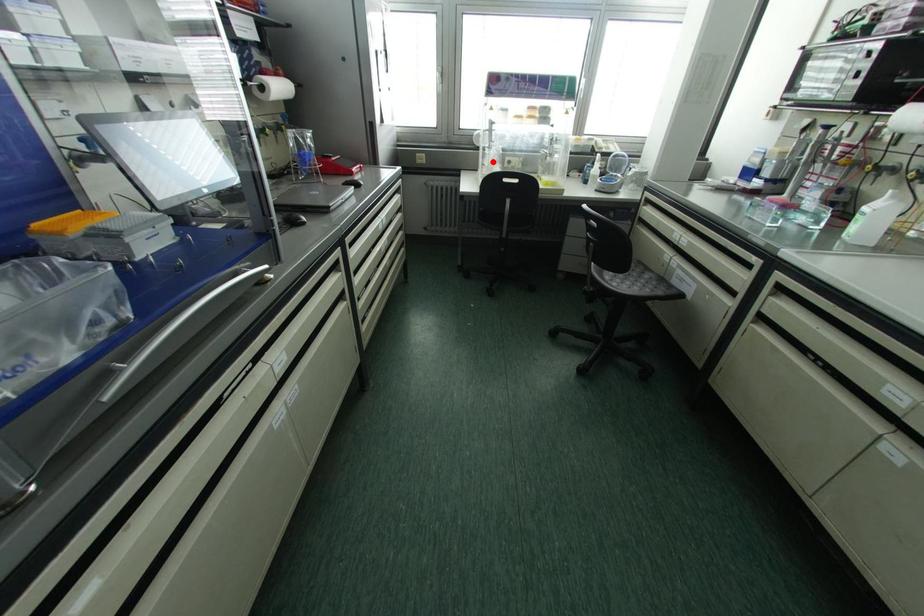
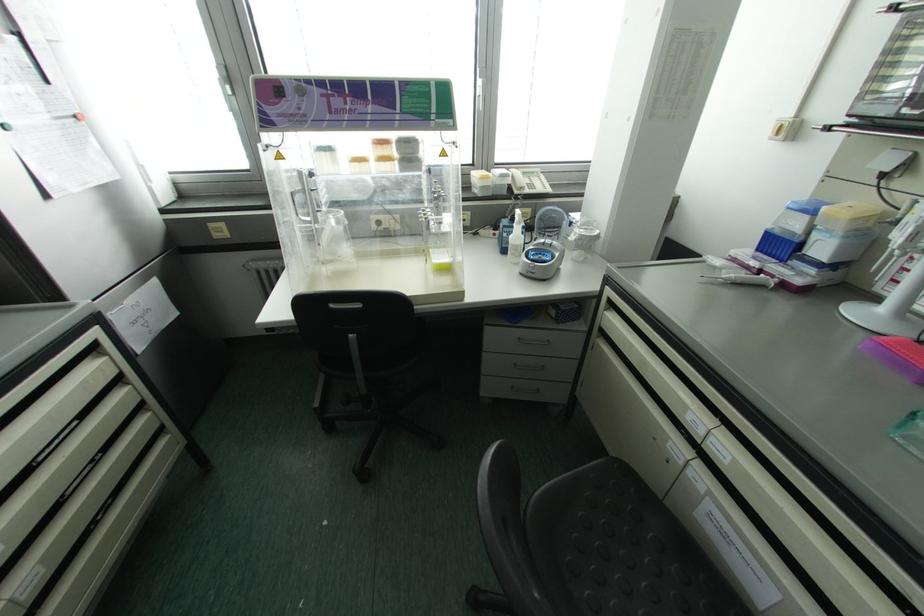
Question: I am providing you with two images of the same scene from different viewpoints. A red point is marked on the first image. Can you still see the location of the red point in image 2?

Choices:
 (A) Yes
 (B) No

Answer: (A)